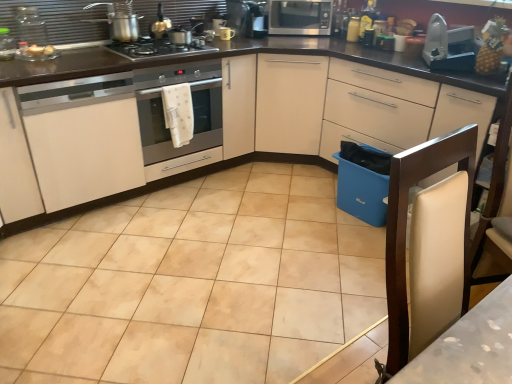
Locate an element on the screen. This screenshot has height=384, width=512. empty space that is ontop of blue plastic bin at lower right is located at coordinates (369, 152).